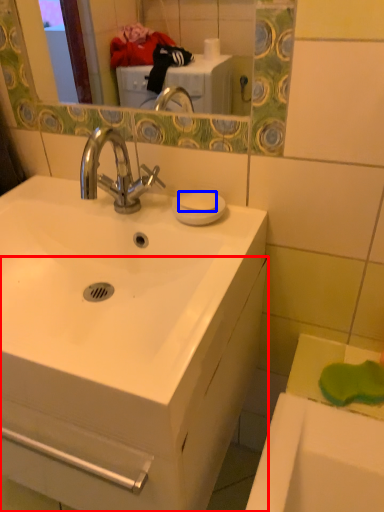
Question: Which object appears farthest to the camera in this image, bathroom cabinet (highlighted by a red box) or soap (highlighted by a blue box)?

Choices:
 (A) bathroom cabinet
 (B) soap

Answer: (B)